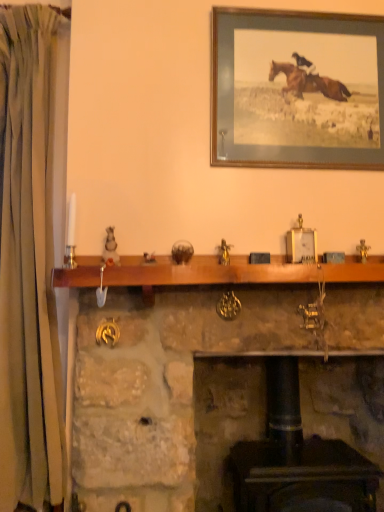
Question: Can you confirm if green fabric curtain at left is smaller than wooden mantle at center?

Choices:
 (A) yes
 (B) no

Answer: (B)

Question: Is green fabric curtain at left not within wooden mantle at center?

Choices:
 (A) no
 (B) yes

Answer: (B)

Question: From a real-world perspective, is green fabric curtain at left located higher than wooden mantle at center?

Choices:
 (A) no
 (B) yes

Answer: (B)

Question: Is green fabric curtain at left oriented towards wooden mantle at center?

Choices:
 (A) no
 (B) yes

Answer: (A)

Question: Is green fabric curtain at left touching wooden mantle at center?

Choices:
 (A) yes
 (B) no

Answer: (B)

Question: Is wooden mantle at center bigger or smaller than green fabric curtain at left?

Choices:
 (A) small
 (B) big

Answer: (A)

Question: Looking at their shapes, would you say wooden mantle at center is wider or thinner than green fabric curtain at left?

Choices:
 (A) wide
 (B) thin

Answer: (B)

Question: From a real-world perspective, is wooden mantle at center physically located above or below green fabric curtain at left?

Choices:
 (A) below
 (B) above

Answer: (A)

Question: Considering the positions of point (276, 266) and point (41, 317), is point (276, 266) closer or farther from the camera than point (41, 317)?

Choices:
 (A) farther
 (B) closer

Answer: (B)

Question: Considering their positions, is wooden picture frame at upper center located in front of or behind green fabric curtain at left?

Choices:
 (A) front
 (B) behind

Answer: (B)

Question: Visually, is wooden picture frame at upper center positioned to the left or to the right of green fabric curtain at left?

Choices:
 (A) left
 (B) right

Answer: (B)

Question: From a real-world perspective, is wooden picture frame at upper center above or below green fabric curtain at left?

Choices:
 (A) above
 (B) below

Answer: (A)

Question: Is wooden picture frame at upper center taller or shorter than green fabric curtain at left?

Choices:
 (A) short
 (B) tall

Answer: (A)

Question: Based on their sizes in the image, would you say wooden picture frame at upper center is bigger or smaller than stone fireplace at center?

Choices:
 (A) small
 (B) big

Answer: (A)

Question: From a real-world perspective, is wooden picture frame at upper center physically located above or below stone fireplace at center?

Choices:
 (A) above
 (B) below

Answer: (A)